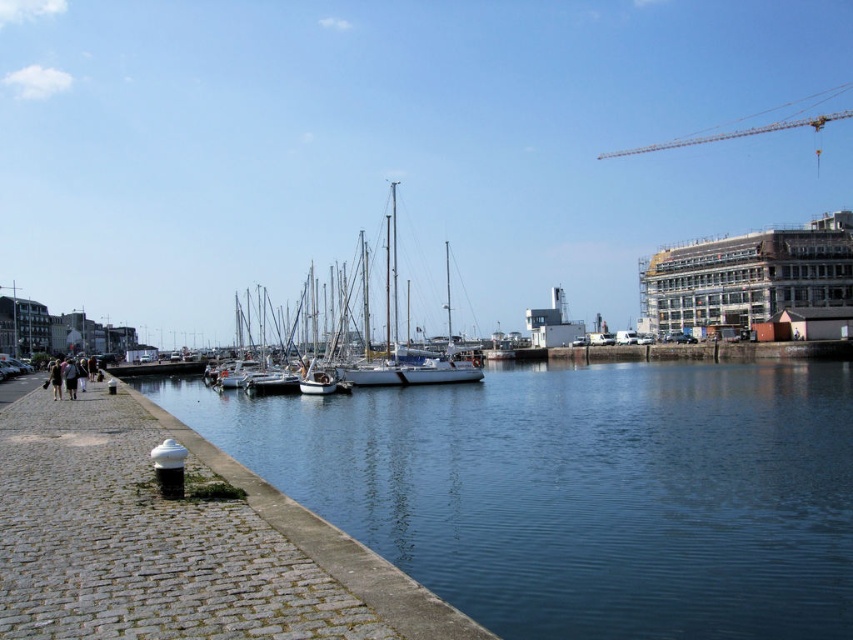
Question: Which of the following is the farthest from the observer?

Choices:
 (A) white glossy sailboat at center
 (B) blue smooth water at lower left
 (C) metallic silver crane at upper right

Answer: (C)

Question: Based on their relative distances, which object is nearer to the white glossy sailboat at center?

Choices:
 (A) blue smooth water at lower left
 (B) metallic silver crane at upper right

Answer: (A)

Question: Does blue smooth water at lower left have a lesser width compared to metallic silver crane at upper right?

Choices:
 (A) no
 (B) yes

Answer: (B)

Question: Based on their relative distances, which object is farther from the metallic silver crane at upper right?

Choices:
 (A) white glossy sailboat at center
 (B) blue smooth water at lower left

Answer: (B)

Question: Is blue smooth water at lower left in front of metallic silver crane at upper right?

Choices:
 (A) no
 (B) yes

Answer: (B)

Question: Can you confirm if blue smooth water at lower left is positioned below white glossy sailboat at center?

Choices:
 (A) yes
 (B) no

Answer: (A)